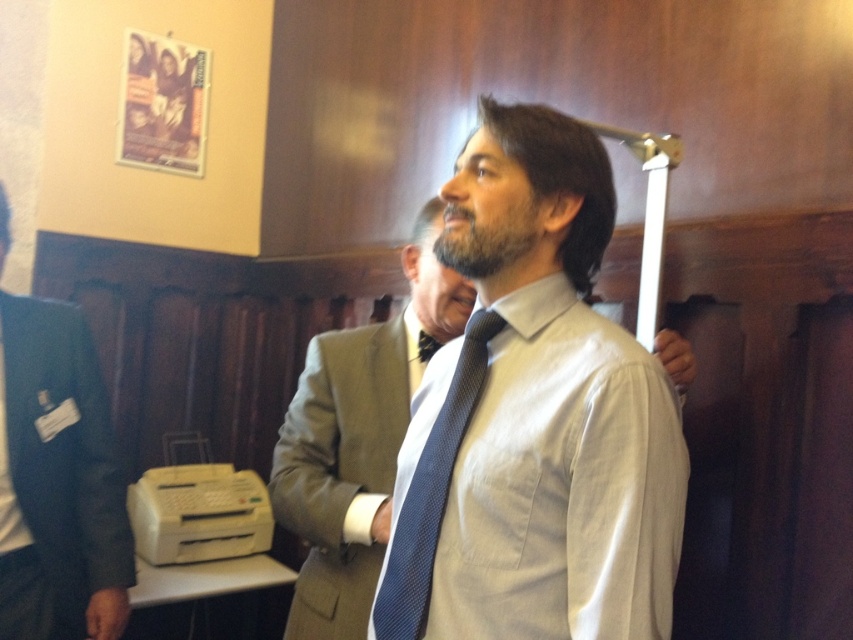
Consider the image. Which of these two, light brown textured suit at center or blue textured tie at center, stands taller?

Standing taller between the two is light brown textured suit at center.

Can you confirm if light brown textured suit at center is positioned to the left of blue textured tie at center?

Indeed, light brown textured suit at center is positioned on the left side of blue textured tie at center.

You are a GUI agent. You are given a task and a screenshot of the screen. Output one action in this format:
    pyautogui.click(x=<x>, y=<y>)
    Task: Click on the light brown textured suit at center
    The image size is (853, 640).
    Given the screenshot: What is the action you would take?
    pyautogui.click(x=341, y=468)

Between point (79, 451) and point (415, 570), which one is positioned in front?

Positioned in front is point (415, 570).

Identify the location of dark blue suit at left. This screenshot has width=853, height=640. (57, 481).

Is dark blue suit at left below light brown textured suit at center?

No.

This screenshot has width=853, height=640. Find the location of `dark blue suit at left`. dark blue suit at left is located at coordinates (57, 481).